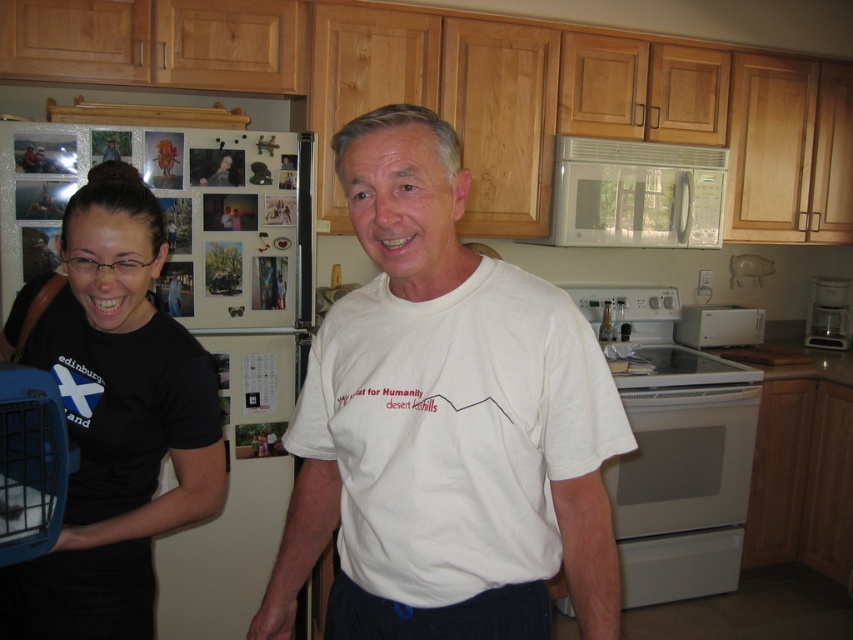
You are a chef in a busy kitchen and need to quickly reach either the white glossy electric stove at center or the white glossy microwave at upper center. Which appliance will you reach first if you move straight forward?

The white glossy electric stove at center is closer to you than the white glossy microwave at upper center, so you will reach the white glossy electric stove at center first.

Please determine if the black matte shirt at left is located at the point with coordinates (112, 419) in the image. Answer yes or no.

Yes, the black matte shirt at left is represented by point (112, 419).